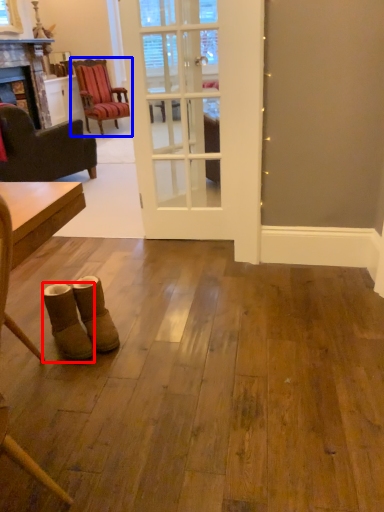
Question: Which object appears farthest to the camera in this image, footwear (highlighted by a red box) or chair (highlighted by a blue box)?

Choices:
 (A) footwear
 (B) chair

Answer: (B)